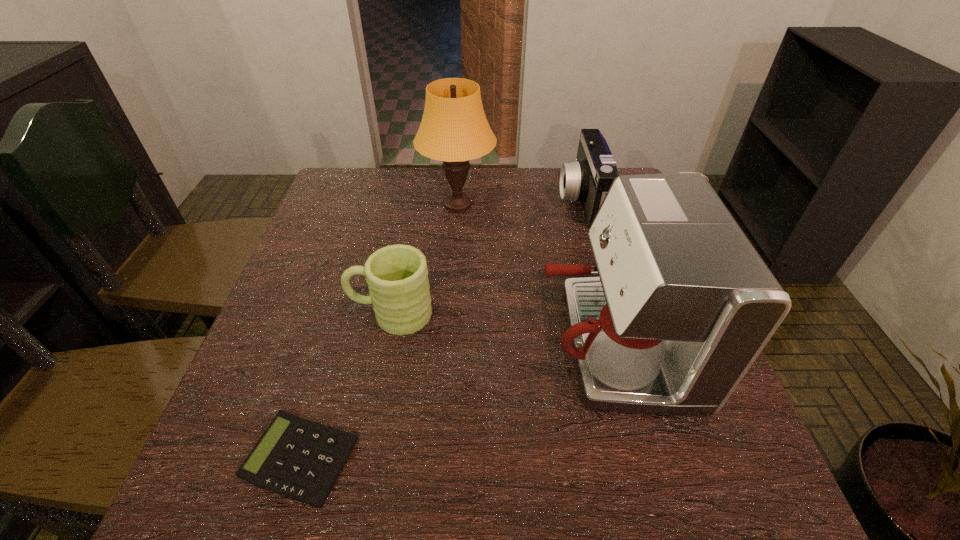
At what (x,y) coordinates should I click in order to perform the action: click on blank space located on the lens of the camcorder. Please return your answer as a coordinate pair (x, y). Looking at the image, I should click on (457, 201).

Image resolution: width=960 pixels, height=540 pixels. What are the coordinates of `vacant space situated 0.350m on the lens of the camcorder` in the screenshot? It's located at (436, 201).

The image size is (960, 540). Identify the location of vacant position located on the side of the mug with the handle. (313, 314).

I want to click on vacant point located 0.160m on the right of the calculator, so (x=453, y=458).

I want to click on lampshade present at the far edge, so click(x=454, y=129).

This screenshot has height=540, width=960. Identify the location of camcorder situated at the far edge. [588, 179].

This screenshot has height=540, width=960. Identify the location of object located in the near edge section of the desktop. (298, 458).

You are a GUI agent. You are given a task and a screenshot of the screen. Output one action in this format:
    pyautogui.click(x=<x>, y=<y>)
    Task: Click on the object present at the left edge
    The image size is (960, 540).
    Given the screenshot: What is the action you would take?
    pyautogui.click(x=298, y=458)

This screenshot has height=540, width=960. I want to click on coffee maker that is at the right edge, so click(684, 304).

This screenshot has height=540, width=960. What are the coordinates of `camcorder positioned at the right edge` in the screenshot? It's located at (588, 179).